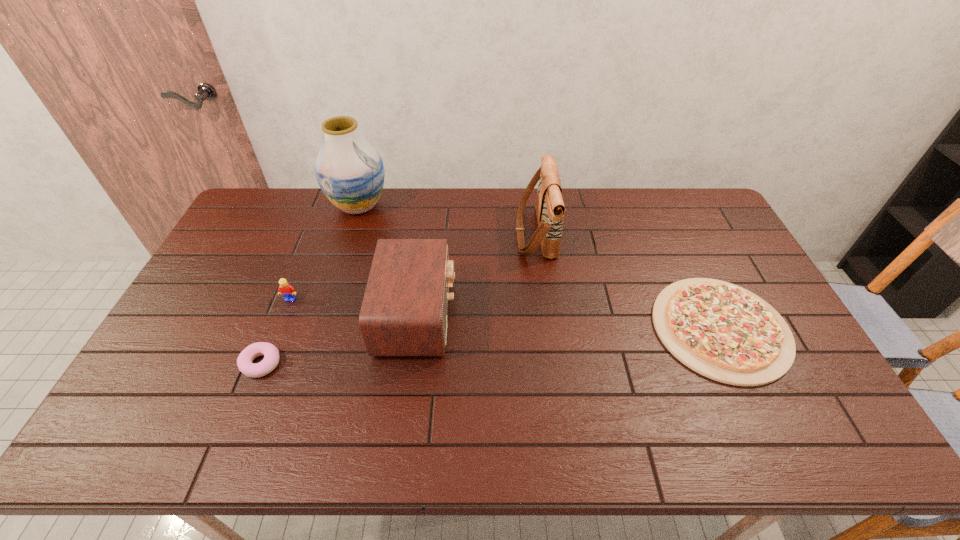
At what (x,y) coordinates should I click in order to perform the action: click on object that is the fourth nearest to the tallest object. Please return your answer as a coordinate pair (x, y). This screenshot has width=960, height=540. Looking at the image, I should click on [x=271, y=354].

This screenshot has width=960, height=540. I want to click on the closest object to the shortest object, so click(x=549, y=205).

What are the coordinates of `vacant space that satisfies the following two spatial constraints: 1. on the front panel of the radio receiver; 2. on the back side of the pizza` in the screenshot? It's located at (415, 328).

Locate an element on the screen. This screenshot has width=960, height=540. vacant region that satisfies the following two spatial constraints: 1. on the front panel of the pizza; 2. on the left side of the fourth object from left to right is located at coordinates (415, 328).

Image resolution: width=960 pixels, height=540 pixels. Identify the location of vacant space that satisfies the following two spatial constraints: 1. on the back side of the vase; 2. on the left side of the fifth tallest object. click(x=324, y=206).

Find the location of `vacant space that satisfies the following two spatial constraints: 1. on the front panel of the fourth object from left to right; 2. on the front side of the fifth tallest object`. vacant space that satisfies the following two spatial constraints: 1. on the front panel of the fourth object from left to right; 2. on the front side of the fifth tallest object is located at coordinates (410, 364).

The image size is (960, 540). In order to click on vacant area that satisfies the following two spatial constraints: 1. on the front panel of the third object from right to left; 2. on the left side of the shortest object in this screenshot , I will do `click(415, 328)`.